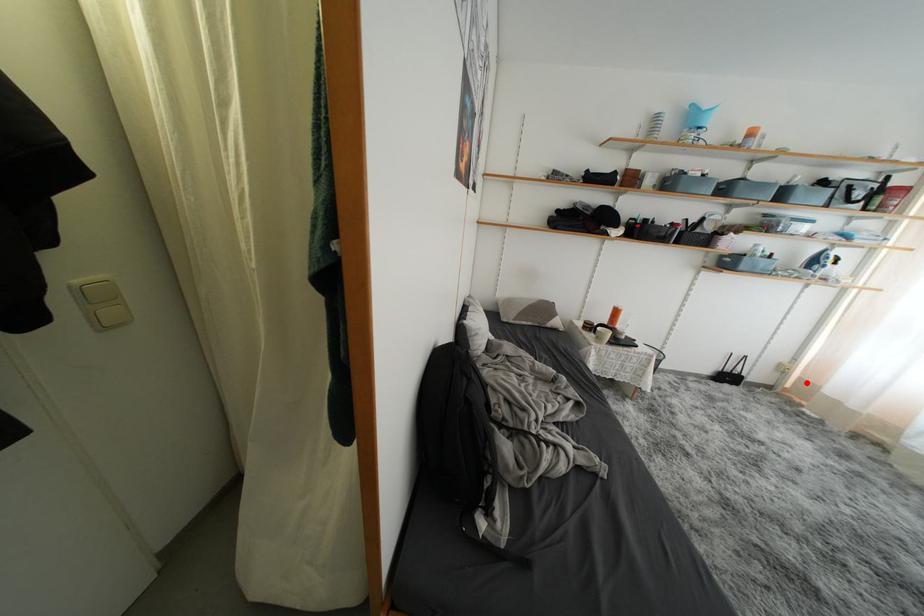
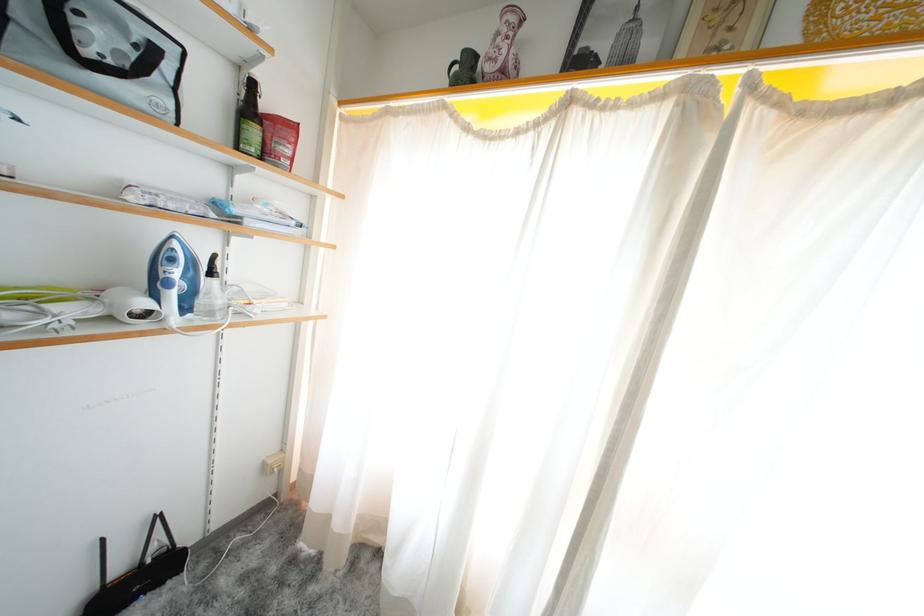
Question: I am providing you with two images of the same scene from different viewpoints. Given a red point in image1, look at the same physical point in image2. Is it:

Choices:
 (A) Closer to the viewpoint
 (B) Farther from the viewpoint

Answer: (B)